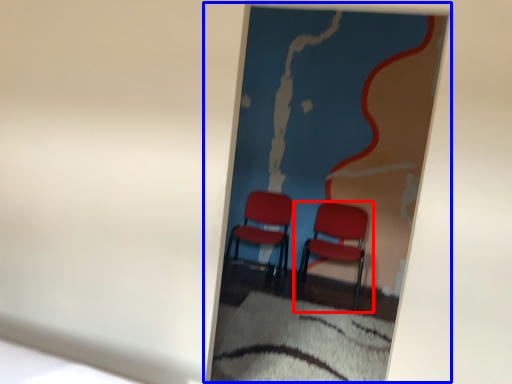
Question: Which point is further to the camera, chair (highlighted by a red box) or picture frame (highlighted by a blue box)?

Choices:
 (A) chair
 (B) picture frame

Answer: (A)